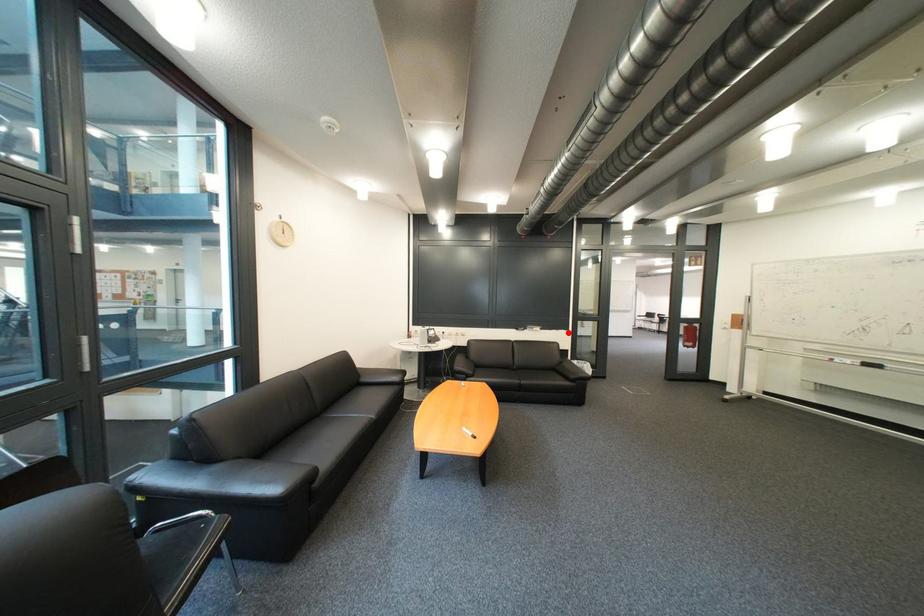
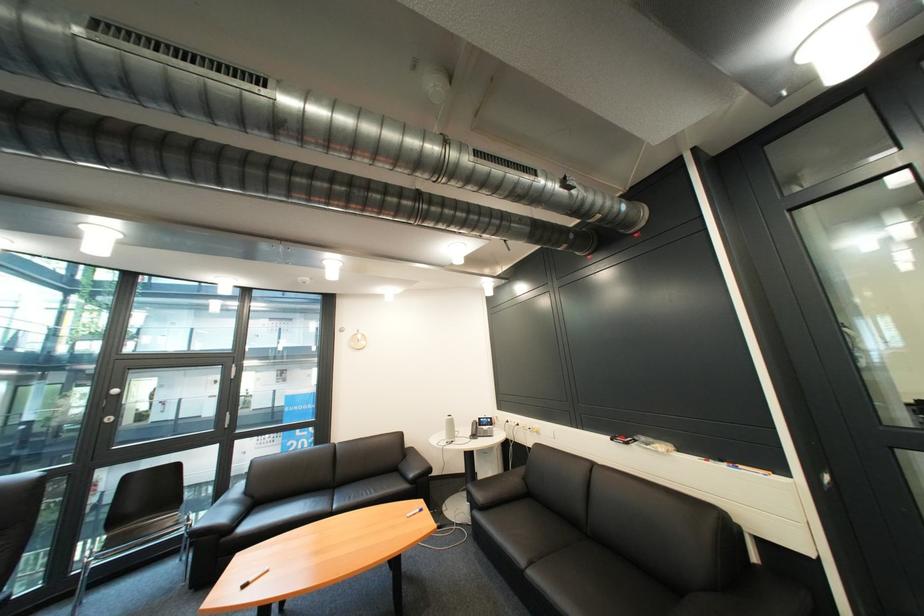
Find the pixel in the second image that matches the highlighted location in the first image.

(736, 468)